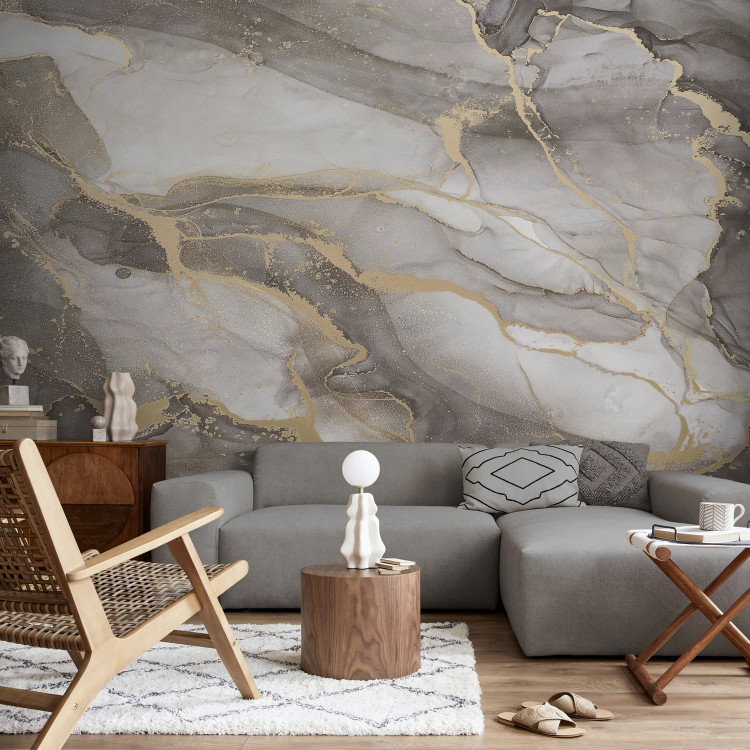
What are the coordinates of `1 vase` in the screenshot? It's located at (118, 408).